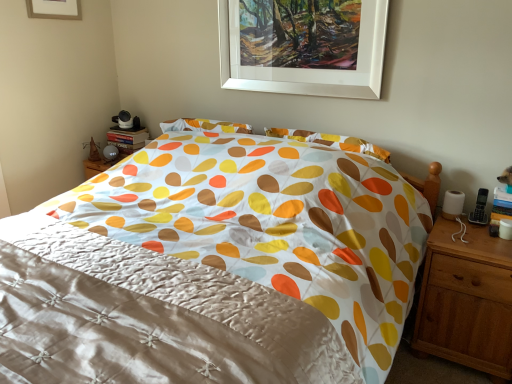
Locate an element on the screen. This screenshot has width=512, height=384. vacant point above white matte picture frame at upper center, marked as the 1th picture frame in a bottom-to-top arrangement (from a real-world perspective) is located at coordinates (269, 0).